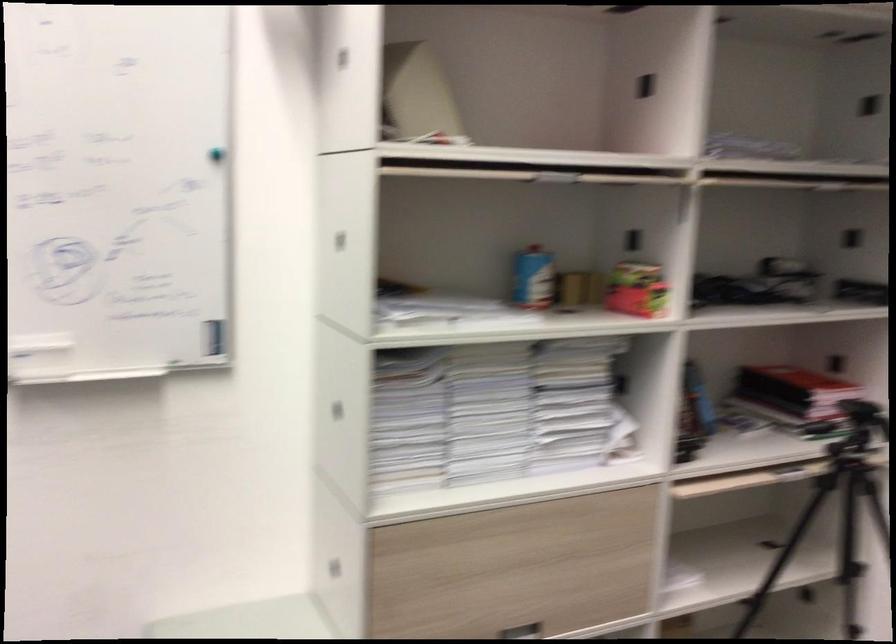
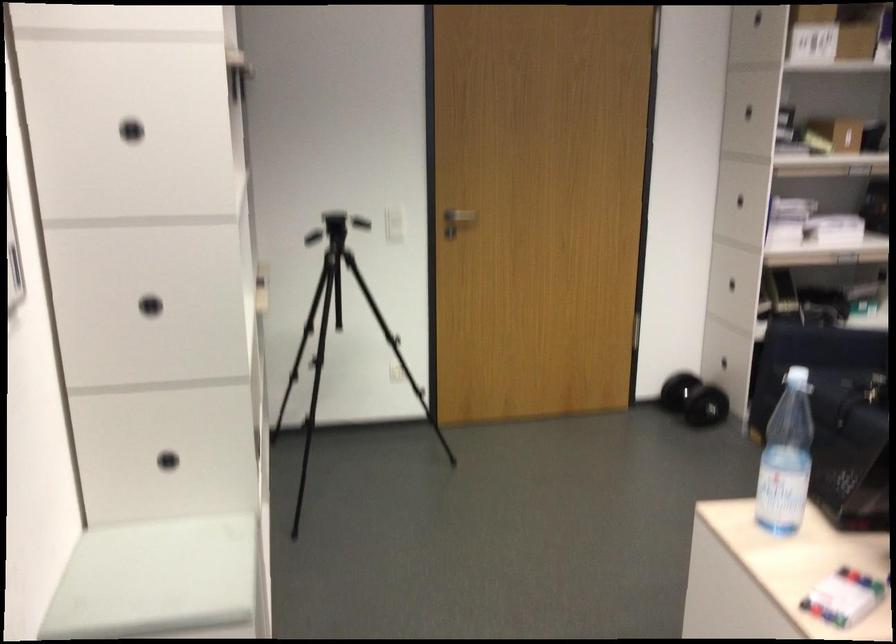
Question: I am providing you with two images of the same scene from different viewpoints. Which of the following objects are not visible in image2?

Choices:
 (A) bench sitting surface
 (B) silver door handle
 (C) metal valve handle
 (D) silver drawer handle

Answer: (D)